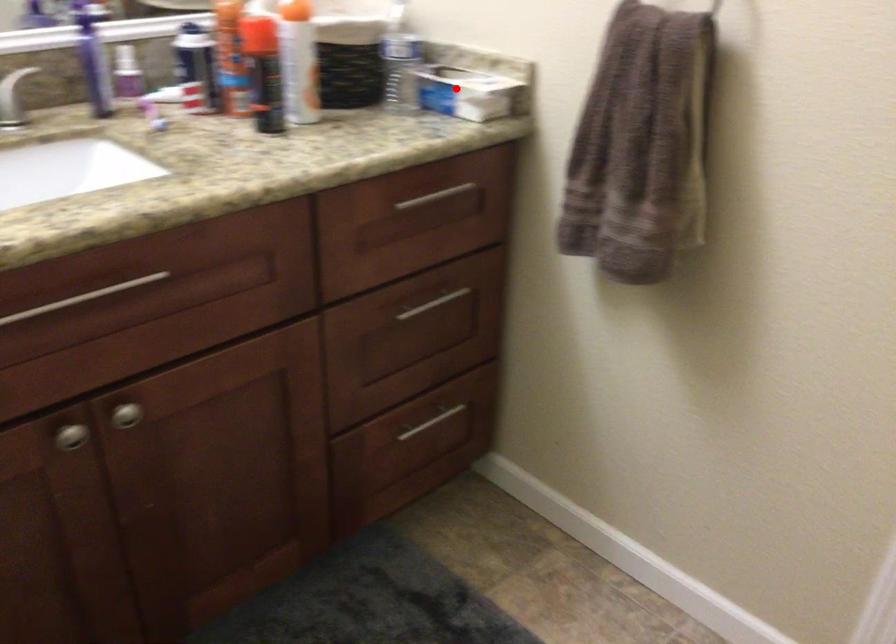
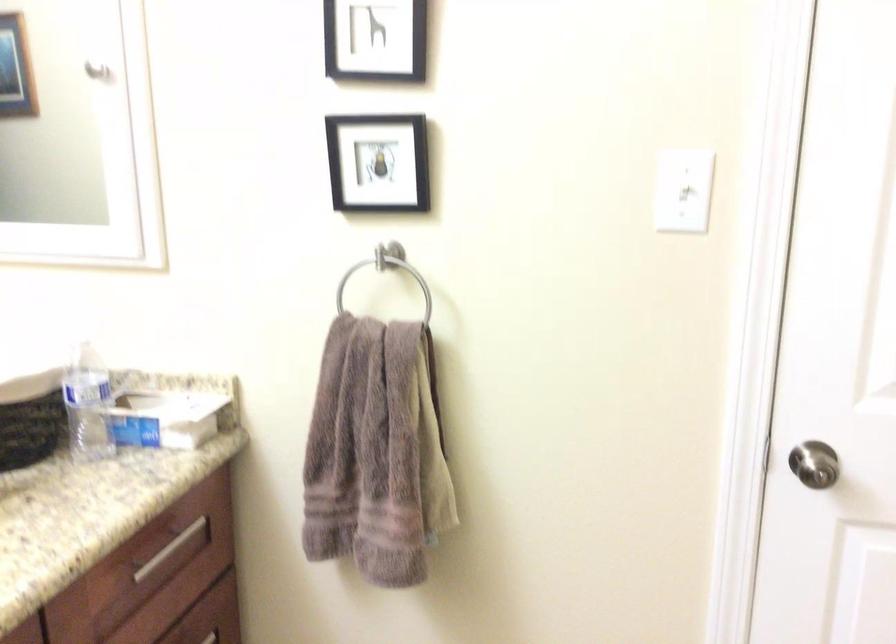
Question: A red point is marked in image1. In image2, is the corresponding 3D point closer to the camera or farther? Reply with the corresponding letter.

Choices:
 (A) The corresponding 3D point is closer.
 (B) The corresponding 3D point is farther.

Answer: (A)